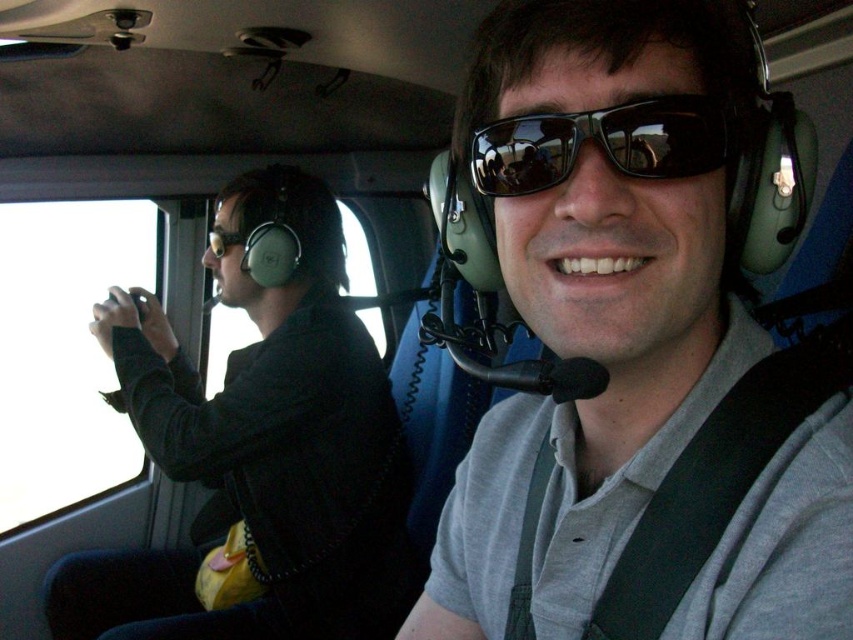
Based on the photo, how far apart are black matte jacket at left and black reflective sunglasses at center?

black matte jacket at left and black reflective sunglasses at center are 3.78 feet apart from each other.

Which is more to the right, black matte jacket at left or black reflective sunglasses at center?

black reflective sunglasses at center is more to the right.

Does point (207, 472) lie in front of point (560, 173)?

No, it is behind (560, 173).

You are a GUI agent. You are given a task and a screenshot of the screen. Output one action in this format:
    pyautogui.click(x=<x>, y=<y>)
    Task: Click on the black matte jacket at left
    This screenshot has height=640, width=853.
    Given the screenshot: What is the action you would take?
    (259, 445)

This screenshot has height=640, width=853. I want to click on matte black sunglasses at center, so click(635, 353).

At what (x,y) coordinates should I click in order to perform the action: click on matte black sunglasses at center. Please return your answer as a coordinate pair (x, y). This screenshot has height=640, width=853. Looking at the image, I should click on (635, 353).

The width and height of the screenshot is (853, 640). In order to click on matte black sunglasses at center in this screenshot , I will do `click(635, 353)`.

Which of these two, matte black sunglasses at center or black matte jacket at left, stands shorter?

matte black sunglasses at center

Between point (769, 451) and point (384, 522), which one is positioned in front?

Point (769, 451)

What are the coordinates of `matte black sunglasses at center` in the screenshot? It's located at (635, 353).